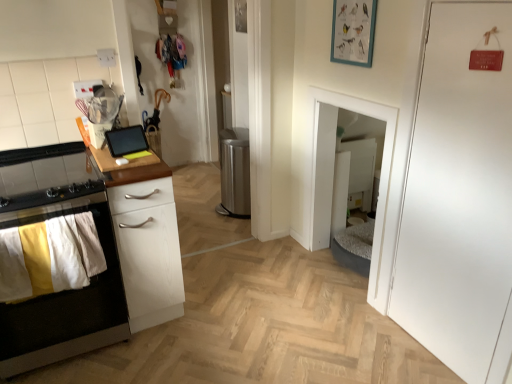
Question: Is matte black tablet at upper left, which is the first appliance from front to back, located outside teal matte picture frame at upper center?

Choices:
 (A) no
 (B) yes

Answer: (B)

Question: Is matte black tablet at upper left, the 2th appliance viewed from the right, turned away from teal matte picture frame at upper center?

Choices:
 (A) yes
 (B) no

Answer: (B)

Question: Can you confirm if matte black tablet at upper left, which ranks as the 1th appliance in left-to-right order, is wider than teal matte picture frame at upper center?

Choices:
 (A) no
 (B) yes

Answer: (B)

Question: From a real-world perspective, is matte black tablet at upper left, which is the first appliance from front to back, on top of teal matte picture frame at upper center?

Choices:
 (A) yes
 (B) no

Answer: (B)

Question: Considering the relative sizes of matte black tablet at upper left, which ranks as the 1th appliance in left-to-right order, and teal matte picture frame at upper center in the image provided, is matte black tablet at upper left, which ranks as the 1th appliance in left-to-right order, bigger than teal matte picture frame at upper center?

Choices:
 (A) no
 (B) yes

Answer: (A)

Question: In the image, is white wood chest of drawers at left on the left side or the right side of stainless steel trash can at center, which is the 2th appliance from front to back?

Choices:
 (A) right
 (B) left

Answer: (B)

Question: Is point (163, 213) positioned closer to the camera than point (236, 165)?

Choices:
 (A) farther
 (B) closer

Answer: (B)

Question: From a real-world perspective, is white wood chest of drawers at left positioned above or below stainless steel trash can at center, the first appliance positioned from the right?

Choices:
 (A) above
 (B) below

Answer: (A)

Question: Is white wood chest of drawers at left wider or thinner than stainless steel trash can at center, which is the 2th appliance from left to right?

Choices:
 (A) thin
 (B) wide

Answer: (B)

Question: Considering their positions, is matte black tablet at upper left, which ranks as the second appliance in back-to-front order, located in front of or behind teal matte picture frame at upper center?

Choices:
 (A) front
 (B) behind

Answer: (B)

Question: From the image's perspective, relative to teal matte picture frame at upper center, is matte black tablet at upper left, which ranks as the 1th appliance in left-to-right order, above or below?

Choices:
 (A) below
 (B) above

Answer: (A)

Question: Considering the positions of matte black tablet at upper left, the 2th appliance viewed from the right, and teal matte picture frame at upper center in the image, is matte black tablet at upper left, the 2th appliance viewed from the right, wider or thinner than teal matte picture frame at upper center?

Choices:
 (A) thin
 (B) wide

Answer: (B)

Question: From a real-world perspective, relative to teal matte picture frame at upper center, is matte black tablet at upper left, which is the first appliance from front to back, vertically above or below?

Choices:
 (A) above
 (B) below

Answer: (B)

Question: From a real-world perspective, relative to yellow and white fabric at left, is stainless steel trash can at center, which is the 2th appliance from left to right, vertically above or below?

Choices:
 (A) below
 (B) above

Answer: (A)

Question: Do you think stainless steel trash can at center, the first appliance positioned from the right, is within yellow and white fabric at left, or outside of it?

Choices:
 (A) inside
 (B) outside

Answer: (B)